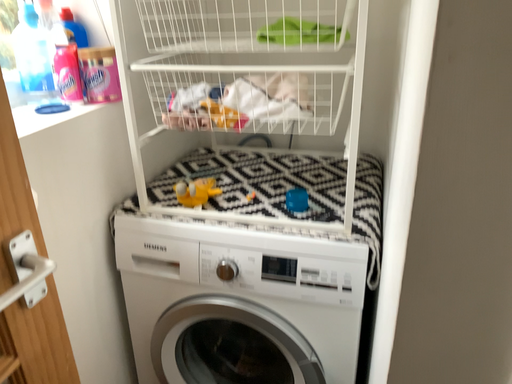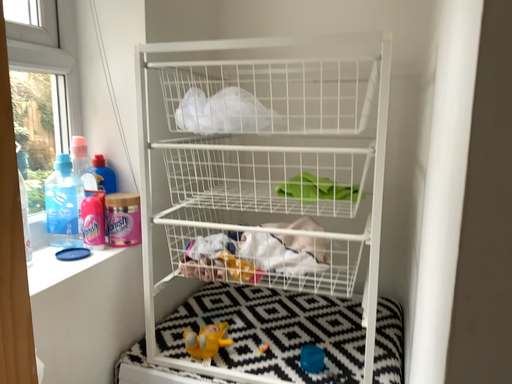
Question: Which way did the camera rotate in the video?

Choices:
 (A) rotated downward
 (B) rotated upward

Answer: (B)